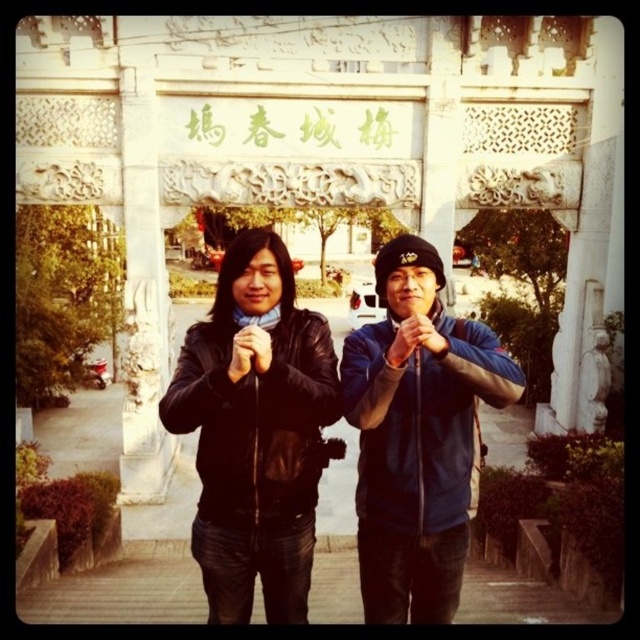
Which of these two, black leather jacket at center or blue fabric jacket at center, stands taller?

With more height is black leather jacket at center.

This screenshot has height=640, width=640. What do you see at coordinates (256, 432) in the screenshot?
I see `black leather jacket at center` at bounding box center [256, 432].

The height and width of the screenshot is (640, 640). In order to click on black leather jacket at center in this screenshot , I will do `click(256, 432)`.